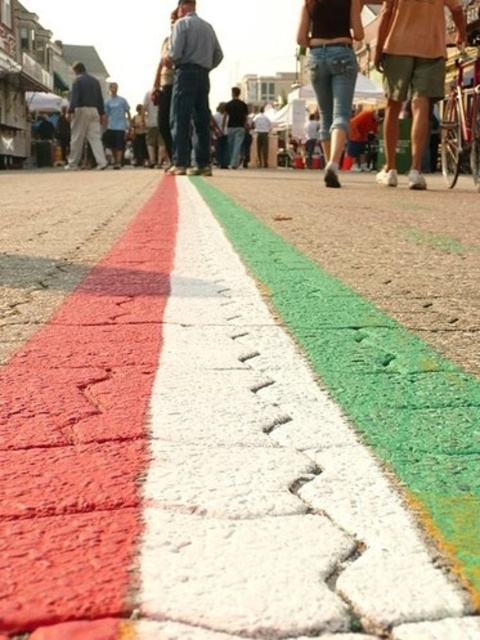
From the picture: You are at the event and see the jeans at center and the light blue shirt at center. Which one is nearer to you?

The jeans at center is closer to the viewer than the light blue shirt at center.

You are at the event and see a person wearing denim pants at center and a light blue shirt at center. From the perspective of someone facing the person, which clothing item is positioned to the right?

The denim pants at center are to the right of the light blue shirt at center from the observer facing the person.